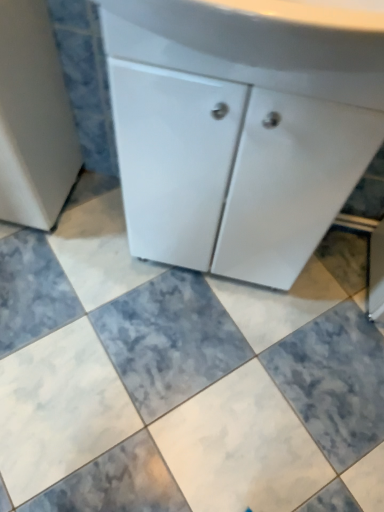
Identify the location of white glossy cabinet at center. (240, 128).

Measure the distance between point (377, 54) and camera.

Result: They are 19.17 inches apart.

The height and width of the screenshot is (512, 384). Describe the element at coordinates (259, 42) in the screenshot. I see `white glossy cabinet at upper center` at that location.

Find the location of a particular element. white glossy cabinet at center is located at coordinates (240, 128).

Does point (372, 31) lie behind point (107, 391)?

That is False.

Is white glossy cabinet at upper center next to marble tile at center?

No.

Is white glossy cabinet at upper center situated inside marble tile at center or outside?

white glossy cabinet at upper center is outside marble tile at center.

From a real-world perspective, is white glossy cabinet at upper center on top of marble tile at center?

Yes, from a real-world perspective, white glossy cabinet at upper center is on top of marble tile at center.

Does white glossy cabinet at center have a lesser width compared to white glossy cabinet at upper center?

Yes, white glossy cabinet at center is thinner than white glossy cabinet at upper center.

Between white glossy cabinet at center and white glossy cabinet at upper center, which one has more height?

Standing taller between the two is white glossy cabinet at center.

This screenshot has width=384, height=512. I want to click on bathroom cabinet on the right side of white glossy cabinet at upper center, so click(240, 128).

Consider the image. From a real-world perspective, between white glossy cabinet at center and white glossy cabinet at upper center, who is vertically lower?

From a 3D spatial view, white glossy cabinet at center is below.

Considering the sizes of objects marble tile at center and white glossy cabinet at upper center in the image provided, who is shorter, marble tile at center or white glossy cabinet at upper center?

marble tile at center is shorter.

Is marble tile at center in front of white glossy cabinet at upper center?

No.

Considering the points (127, 288) and (314, 28), which point is behind, point (127, 288) or point (314, 28)?

Positioned behind is point (127, 288).

Choose the correct answer: Is white glossy cabinet at upper center inside white glossy cabinet at center or outside it?

white glossy cabinet at upper center lies outside white glossy cabinet at center.

How different are the orientations of white glossy cabinet at upper center and white glossy cabinet at center in degrees?

There is a 0.000617-degree angle between the facing directions of white glossy cabinet at upper center and white glossy cabinet at center.

From the image's perspective, between white glossy cabinet at upper center and white glossy cabinet at center, who is located below?

white glossy cabinet at center.

Who is shorter, white glossy cabinet at upper center or white glossy cabinet at center?

Standing shorter between the two is white glossy cabinet at upper center.

In the scene shown: From a real-world perspective, between marble tile at center and white glossy cabinet at center, who is vertically higher?

white glossy cabinet at center, from a real-world perspective.

From the picture: Is marble tile at center not within white glossy cabinet at center?

marble tile at center is positioned outside white glossy cabinet at center.

From the image's perspective, would you say marble tile at center is positioned over white glossy cabinet at center?

No.

Considering their positions, is marble tile at center located in front of or behind white glossy cabinet at center?

Clearly, marble tile at center is behind white glossy cabinet at center.

From a real-world perspective, is white glossy cabinet at center above or below marble tile at center?

From a real-world perspective, white glossy cabinet at center is physically above marble tile at center.

You are a GUI agent. You are given a task and a screenshot of the screen. Output one action in this format:
    pyautogui.click(x=<x>, y=<y>)
    Task: Click on the bathroom cabinet on the right of marble tile at center
    
    Given the screenshot: What is the action you would take?
    pyautogui.click(x=240, y=128)

Is white glossy cabinet at center oriented towards marble tile at center?

Yes, white glossy cabinet at center is oriented towards marble tile at center.

Measure the distance from white glossy cabinet at center to marble tile at center.

They are 16.17 inches apart.

Where is `counter top in front of the marble tile at center`? The width and height of the screenshot is (384, 512). counter top in front of the marble tile at center is located at coordinates (259, 42).

Where is `counter top that appears above the white glossy cabinet at center (from a real-world perspective)`? This screenshot has height=512, width=384. counter top that appears above the white glossy cabinet at center (from a real-world perspective) is located at coordinates (259, 42).

Which object lies further to the anchor point marble tile at center, white glossy cabinet at center or white glossy cabinet at upper center?

The object further to marble tile at center is white glossy cabinet at upper center.

Based on the photo, looking at the image, which one is located closer to white glossy cabinet at center, marble tile at center or white glossy cabinet at upper center?

white glossy cabinet at upper center is positioned closer to the anchor white glossy cabinet at center.

When comparing their distances from marble tile at center, does white glossy cabinet at upper center or white glossy cabinet at center seem further?

Among the two, white glossy cabinet at upper center is located further to marble tile at center.

Estimate the real-world distances between objects in this image. Which object is closer to white glossy cabinet at upper center, white glossy cabinet at center or marble tile at center?

Based on the image, white glossy cabinet at center appears to be nearer to white glossy cabinet at upper center.

From the image, which object appears to be nearer to white glossy cabinet at upper center, marble tile at center or white glossy cabinet at center?

The object closer to white glossy cabinet at upper center is white glossy cabinet at center.

When comparing their distances from white glossy cabinet at center, does white glossy cabinet at upper center or marble tile at center seem further?

Based on the image, marble tile at center appears to be further to white glossy cabinet at center.

Locate an element on the screen. This screenshot has height=512, width=384. bathroom cabinet between white glossy cabinet at upper center and marble tile at center from top to bottom is located at coordinates (240, 128).